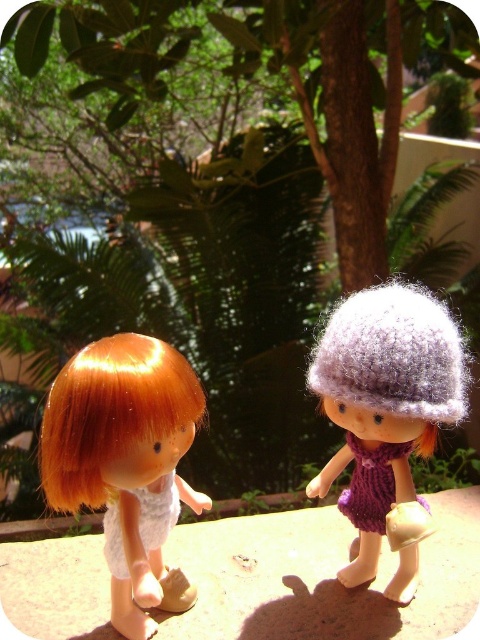
Question: Which object appears farthest from the camera in this image?

Choices:
 (A) shiny orange hair at center
 (B) purple knitted hat at right

Answer: (B)

Question: Does shiny orange hair at center lie in front of purple knitted hat at right?

Choices:
 (A) yes
 (B) no

Answer: (A)

Question: Can you confirm if shiny orange hair at center is wider than purple knitted hat at right?

Choices:
 (A) no
 (B) yes

Answer: (A)

Question: Does shiny orange hair at center have a larger size compared to purple knitted hat at right?

Choices:
 (A) yes
 (B) no

Answer: (B)